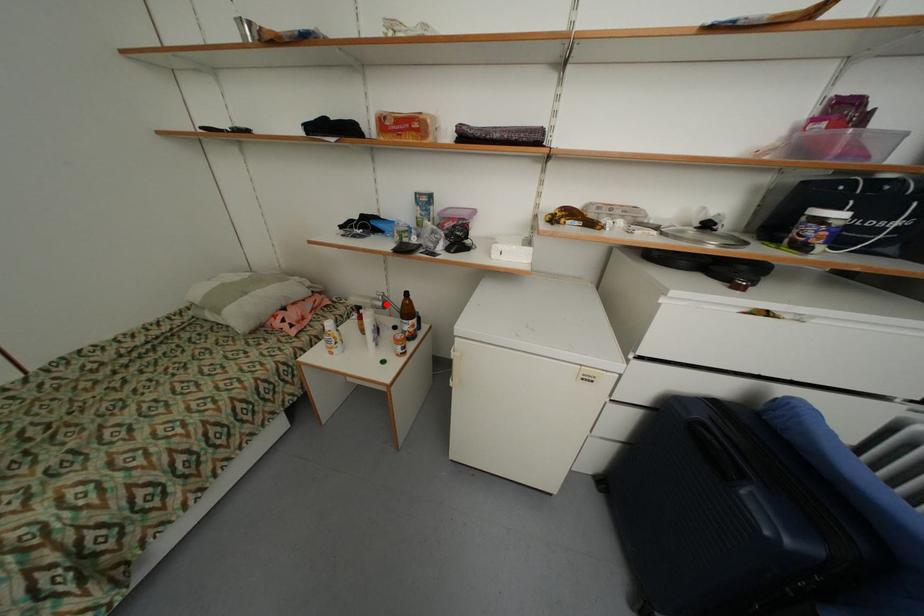
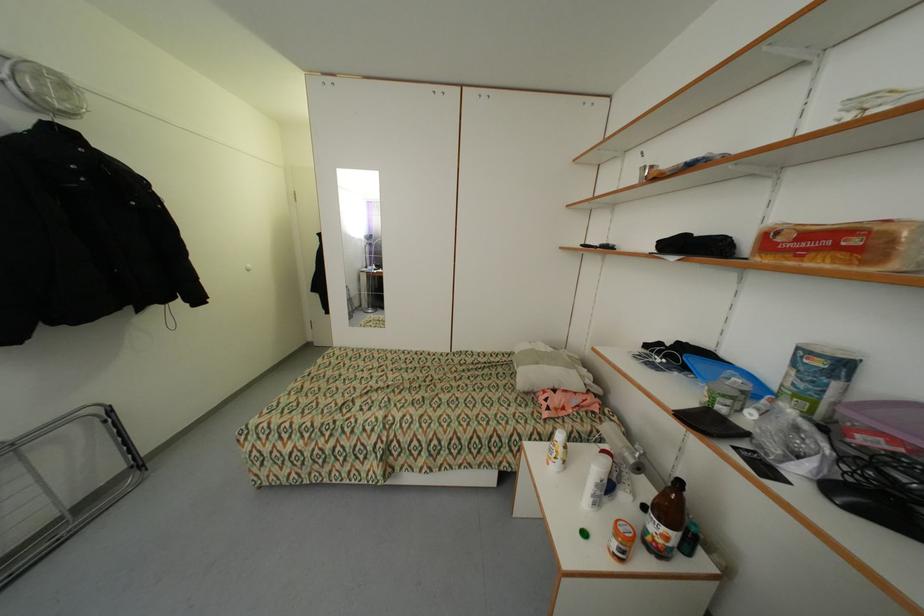
Where in the second image is the point corresponding to the highlighted location from the first image?

(638, 462)